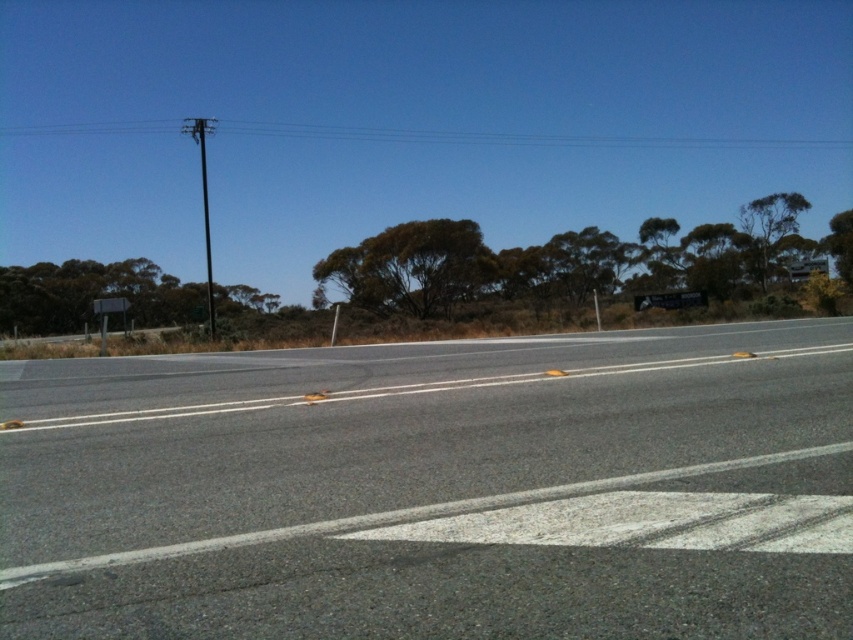
Question: Where is gray asphalt road at center located in relation to black plastic sign at upper right in the image?

Choices:
 (A) above
 (B) below

Answer: (B)

Question: Which of the following is the closest to the observer?

Choices:
 (A) (637, 298)
 (B) (653, 618)

Answer: (B)

Question: Which point is farther to the camera?

Choices:
 (A) black plastic sign at upper right
 (B) gray asphalt road at center

Answer: (A)

Question: Does gray asphalt road at center appear under black plastic sign at upper right?

Choices:
 (A) yes
 (B) no

Answer: (A)

Question: From the image, what is the correct spatial relationship of gray asphalt road at center in relation to black plastic sign at upper right?

Choices:
 (A) above
 (B) below

Answer: (B)